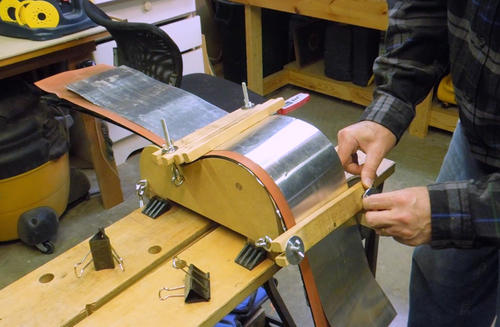
This screenshot has height=327, width=500. Identify the location of shop vaccum. 29,149.